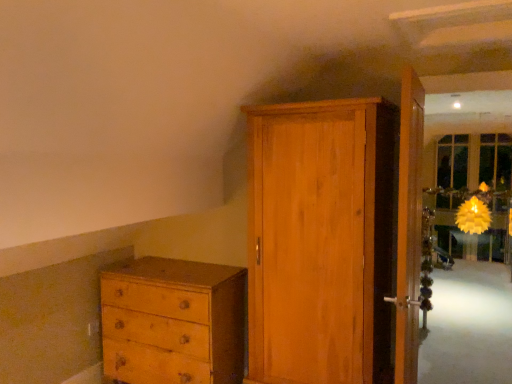
Question: Should I look upward or downward to see wooden door at right, acting as the 2th door starting from the left?

Choices:
 (A) up
 (B) down

Answer: (B)

Question: In which direction should I rotate to look at wooden wardrobe at center, the 1th door viewed from the left?

Choices:
 (A) left
 (B) right

Answer: (B)

Question: Considering the relative sizes of wooden wardrobe at center, the 1th door viewed from the left, and light brown wood chest of drawers at lower left in the image provided, is wooden wardrobe at center, the 1th door viewed from the left, wider than light brown wood chest of drawers at lower left?

Choices:
 (A) no
 (B) yes

Answer: (B)

Question: Considering the relative positions of wooden wardrobe at center, the 1th door viewed from the left, and light brown wood chest of drawers at lower left in the image provided, is wooden wardrobe at center, the 1th door viewed from the left, to the right of light brown wood chest of drawers at lower left from the viewer's perspective?

Choices:
 (A) no
 (B) yes

Answer: (B)

Question: Can you see wooden wardrobe at center, the 1th door viewed from the left, touching light brown wood chest of drawers at lower left?

Choices:
 (A) no
 (B) yes

Answer: (A)

Question: Is the position of wooden wardrobe at center, the 1th door viewed from the left, more distant than that of light brown wood chest of drawers at lower left?

Choices:
 (A) yes
 (B) no

Answer: (B)

Question: From the image's perspective, is wooden wardrobe at center, the 1th door viewed from the left, above light brown wood chest of drawers at lower left?

Choices:
 (A) yes
 (B) no

Answer: (A)

Question: Is wooden wardrobe at center, the 1th door viewed from the left, aimed at light brown wood chest of drawers at lower left?

Choices:
 (A) no
 (B) yes

Answer: (A)

Question: From the image's perspective, is light brown wood chest of drawers at lower left above wooden wardrobe at center, the 1th door viewed from the left?

Choices:
 (A) no
 (B) yes

Answer: (A)

Question: Is light brown wood chest of drawers at lower left at the right side of wooden wardrobe at center, the 1th door viewed from the left?

Choices:
 (A) yes
 (B) no

Answer: (B)

Question: Can you confirm if light brown wood chest of drawers at lower left is positioned to the left of wooden wardrobe at center, the second door viewed from the right?

Choices:
 (A) no
 (B) yes

Answer: (B)

Question: Is light brown wood chest of drawers at lower left bigger than wooden wardrobe at center, the second door viewed from the right?

Choices:
 (A) yes
 (B) no

Answer: (B)

Question: From a real-world perspective, is light brown wood chest of drawers at lower left physically below wooden wardrobe at center, the second door viewed from the right?

Choices:
 (A) yes
 (B) no

Answer: (A)

Question: Can you confirm if light brown wood chest of drawers at lower left is smaller than wooden wardrobe at center, the second door viewed from the right?

Choices:
 (A) no
 (B) yes

Answer: (B)

Question: Is wooden door at right, which is counted as the first door, starting from the right, positioned far away from wooden wardrobe at center, the 1th door viewed from the left?

Choices:
 (A) yes
 (B) no

Answer: (B)